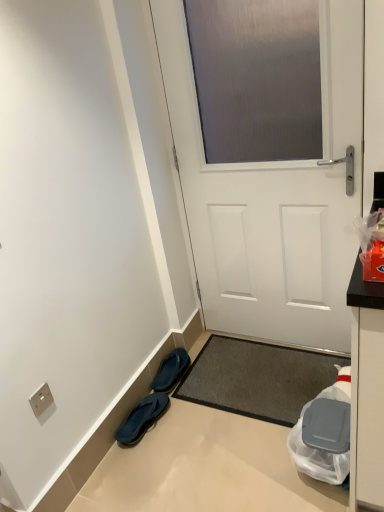
Identify the location of free space in front of blue rubber flip-flops at lower left, the 1th footwear viewed from the front. (143, 465).